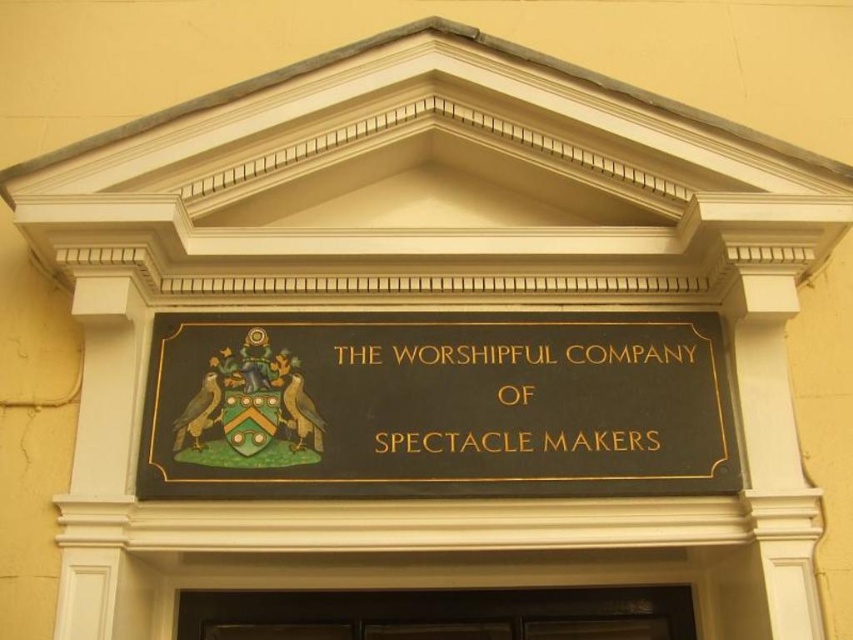
You are standing in front of a building and see a black polished wood sign at center and a black wood door at center. Which object is positioned higher up?

The black polished wood sign at center is located above the black wood door at center, so it is positioned higher up.